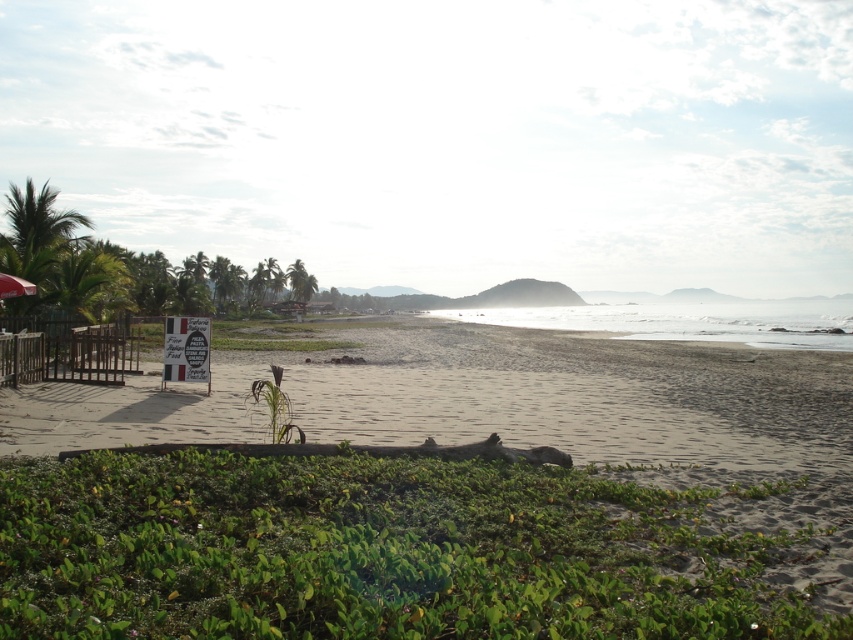
Can you confirm if green leafy vegetation at lower center is smaller than green leafy plants at left?

Indeed, green leafy vegetation at lower center has a smaller size compared to green leafy plants at left.

Between green leafy vegetation at lower center and green leafy plants at left, which one appears on the left side from the viewer's perspective?

Positioned to the left is green leafy plants at left.

The height and width of the screenshot is (640, 853). What do you see at coordinates (380, 552) in the screenshot? I see `green leafy vegetation at lower center` at bounding box center [380, 552].

Find the location of a particular element. This screenshot has height=640, width=853. green leafy vegetation at lower center is located at coordinates [x=380, y=552].

Can you confirm if green leafy vegetation at lower center is positioned to the left of matte black umbrella at lower left?

Incorrect, green leafy vegetation at lower center is not on the left side of matte black umbrella at lower left.

Who is more distant from viewer, [669,573] or [27,294]?

Positioned behind is point [27,294].

I want to click on green leafy vegetation at lower center, so click(x=380, y=552).

Describe the element at coordinates (125, 269) in the screenshot. This screenshot has width=853, height=640. I see `green leafy plants at left` at that location.

Who is positioned more to the left, green leafy plants at left or matte black umbrella at lower left?

green leafy plants at left is more to the left.

Identify the location of green leafy plants at left. The image size is (853, 640). coord(125,269).

The height and width of the screenshot is (640, 853). I want to click on green leafy plants at left, so click(125, 269).